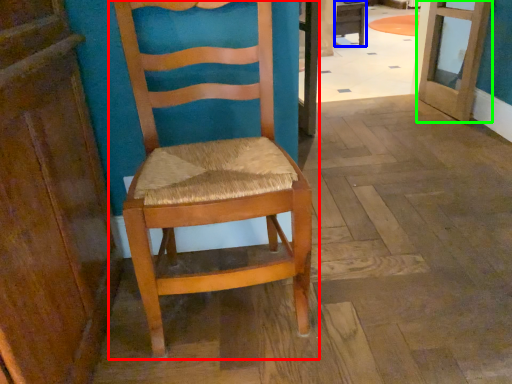
Question: Considering the real-world distances, which object is farthest from chair (highlighted by a red box)? table (highlighted by a blue box) or door (highlighted by a green box)?

Choices:
 (A) table
 (B) door

Answer: (A)